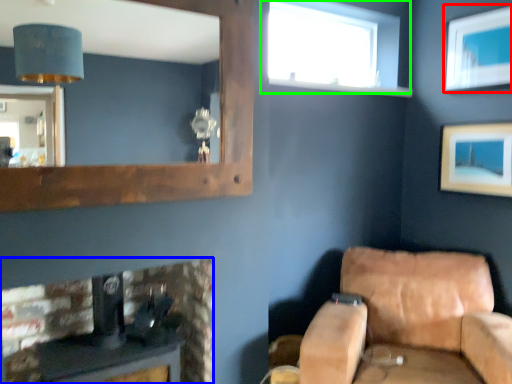
Question: Based on their relative distances, which object is nearer to picture frame (highlighted by a red box)? Choose from furniture (highlighted by a blue box) and window (highlighted by a green box).

Choices:
 (A) furniture
 (B) window

Answer: (B)